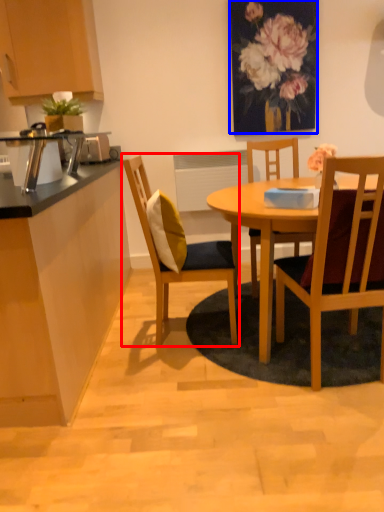
Question: Which object appears closest to the camera in this image, chair (highlighted by a red box) or floral arrangement (highlighted by a blue box)?

Choices:
 (A) chair
 (B) floral arrangement

Answer: (A)